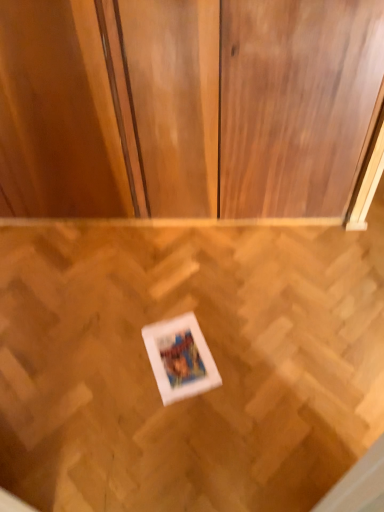
The image size is (384, 512). What are the coordinates of `vacant space underneath white matte picture frame at center (from a real-world perspective)` in the screenshot? It's located at (182, 356).